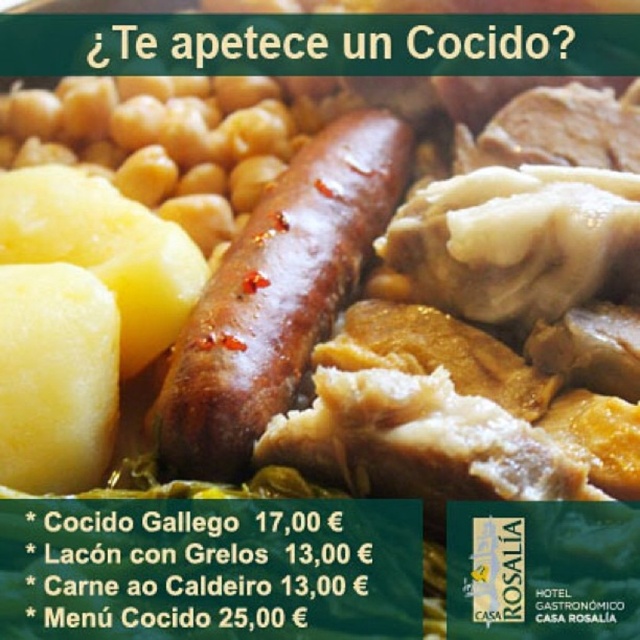
You are a food photographer arranging a dish with the yellow smooth potato at left and the yellow matte potato at lower left. To ensure both potatoes are equally visible in the photo, which potato should you adjust to be shorter?

The yellow smooth potato at left is much taller than the yellow matte potato at lower left, so you should adjust the yellow smooth potato at left to be shorter to ensure both are equally visible.

You are a food critic examining the Cocido dish. You notice two yellow potatoes in the foreground. Which potato is closer to you, the yellow smooth potato at left or the yellow matte potato at lower left?

The yellow smooth potato at left is closer to you than the yellow matte potato at lower left.

You are a food critic analyzing the composition of the Cocido dish. Based on the image, where is the yellow smooth potato at left positioned in terms of coordinates?

The yellow smooth potato at left is positioned at coordinates approximately 0.497 in the x axis and 0.123 in the y axis.